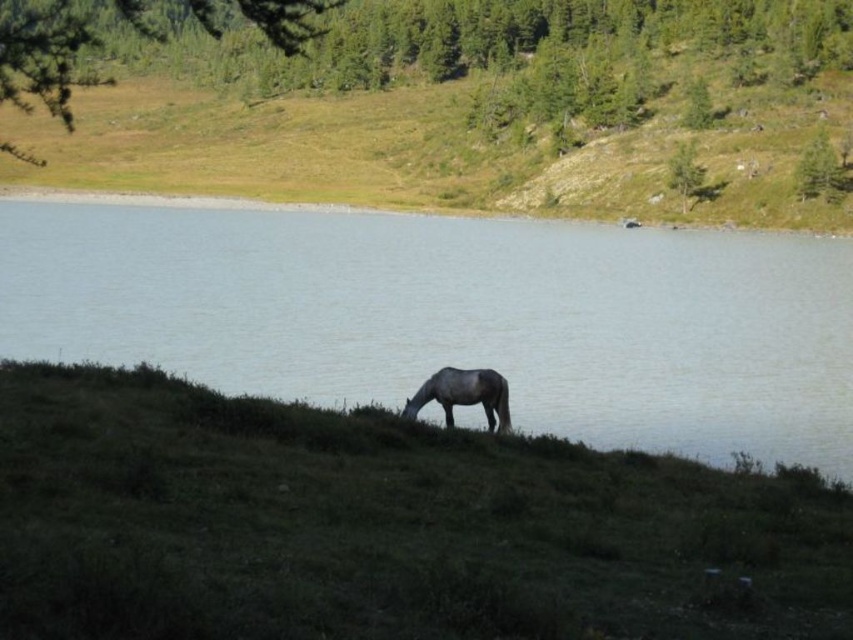
You are a photographer planning to take a photo of the clear water at center and the gray matte horse at lower center. You want to ensure both are in focus. Which object should you adjust your camera focus on first to achieve this?

The clear water at center is much taller than the gray matte horse at lower center. To ensure both are in focus, you should focus on the gray matte horse at lower center first since it is closer to the camera.

You are standing at the edge of the water and see the gray matte horse at lower center and the green grassy hillside at center. Which object is closer to your right side?

The gray matte horse at lower center is closer to your right side because the green grassy hillside at center is positioned on the left side of it.

You are standing at the edge of the water and want to walk towards the green grassy hillside at center. Which path would require less effort, walking through the green grassy at lower center or going around it?

Walking through the green grassy at lower center would require less effort because it is shorter than the green grassy hillside at center, making it easier to traverse.